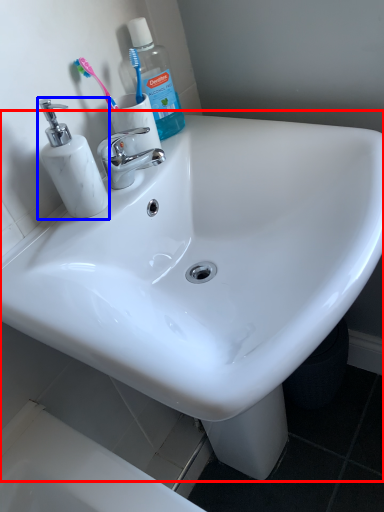
Question: Which object appears closest to the camera in this image, sink (highlighted by a red box) or soap dispenser (highlighted by a blue box)?

Choices:
 (A) sink
 (B) soap dispenser

Answer: (A)